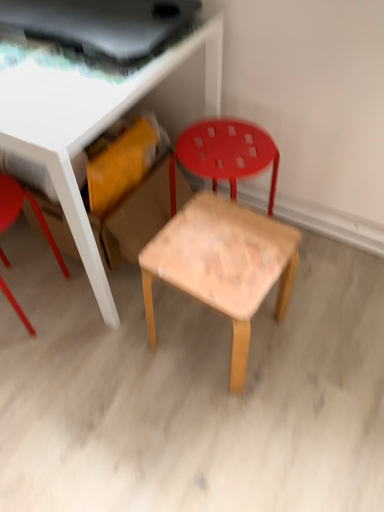
The image size is (384, 512). What are the coordinates of `vacant space underneath natural wood stool at center (from a real-world perspective)` in the screenshot? It's located at (200, 335).